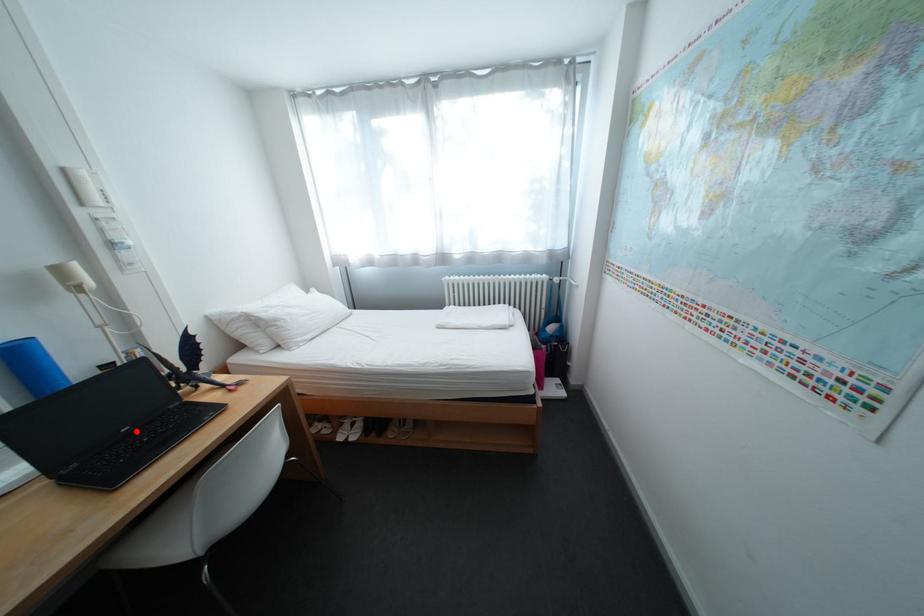
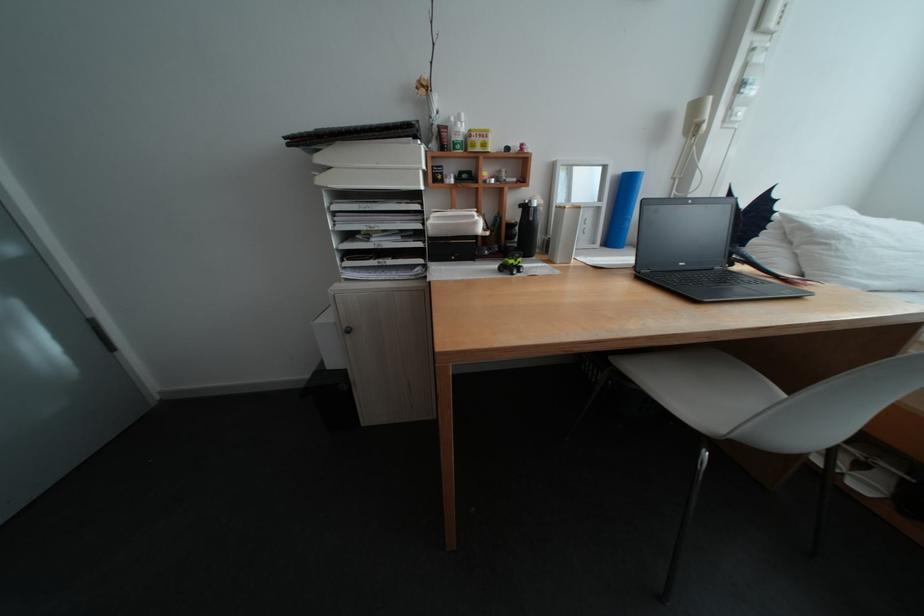
In the second image, find the point that corresponds to the highlighted location in the first image.

(694, 265)